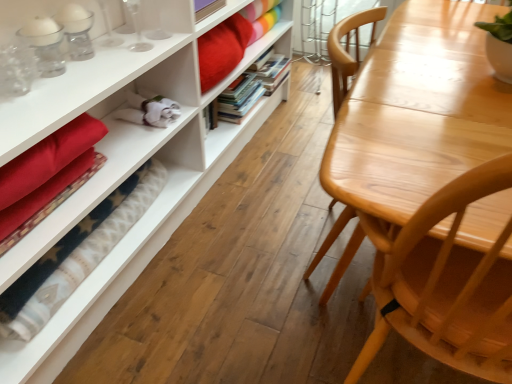
The height and width of the screenshot is (384, 512). In order to click on hardcover books at center, the 2th book viewed from the front in this screenshot , I will do `click(273, 72)`.

Measure the distance between velvet red blanket at lower left and camera.

The distance of velvet red blanket at lower left from camera is 39.24 inches.

In order to face velvet red blanket at lower left, should I rotate leftwards or rightwards?

A 19.939 degree turn to the left will do.

The height and width of the screenshot is (384, 512). I want to click on hardcover books at center, the 2th book viewed from the front, so click(x=273, y=72).

Based on the photo, is hardcover books at center, arranged as the second book when viewed from the back, oriented towards matte white bookcase at left?

No, hardcover books at center, arranged as the second book when viewed from the back, does not turn towards matte white bookcase at left.

From the image's perspective, is hardcover books at center, positioned as the first book in front-to-back order, above or below matte white bookcase at left?

Based on their image positions, hardcover books at center, positioned as the first book in front-to-back order, is located above matte white bookcase at left.

Does hardcover books at center, positioned as the first book in front-to-back order, lie behind matte white bookcase at left?

That is True.

Is matte white bookcase at left positioned with its back to hardcover books at center, arranged as the first book when viewed from the back?

matte white bookcase at left does not have its back to hardcover books at center, arranged as the first book when viewed from the back.

Who is smaller, matte white bookcase at left or hardcover books at center, the 2th book viewed from the front?

With smaller size is hardcover books at center, the 2th book viewed from the front.

Can you tell me how much matte white bookcase at left and hardcover books at center, the 2th book viewed from the front, differ in facing direction?

The angular difference between matte white bookcase at left and hardcover books at center, the 2th book viewed from the front, is 89.7 degrees.

Between matte white bookcase at left and hardcover books at center, arranged as the first book when viewed from the back, which one has less height?

With less height is matte white bookcase at left.

From a real-world perspective, which object stands above the other?

From a 3D spatial view, hardcover books at center, arranged as the first book when viewed from the back, is above.

Which of these two, velvet red blanket at lower left or hardcover books at center, the 2th book viewed from the front, is thinner?

Thinner between the two is velvet red blanket at lower left.

Does velvet red blanket at lower left have a lesser height compared to hardcover books at center, the 2th book viewed from the front?

Yes.

Is velvet red blanket at lower left in front of or behind hardcover books at center, arranged as the first book when viewed from the back, in the image?

Visually, velvet red blanket at lower left is located in front of hardcover books at center, arranged as the first book when viewed from the back.

How distant is hardcover books at center, the 2th book viewed from the front, from matte white bookcase at left?

hardcover books at center, the 2th book viewed from the front, is 33.00 inches from matte white bookcase at left.

Is hardcover books at center, the 2th book viewed from the front, with matte white bookcase at left?

There is a gap between hardcover books at center, the 2th book viewed from the front, and matte white bookcase at left.

From a real-world perspective, who is located lower, hardcover books at center, arranged as the first book when viewed from the back, or matte white bookcase at left?

matte white bookcase at left, from a real-world perspective.

Does hardcover books at center, the 2th book viewed from the front, have a larger size compared to matte white bookcase at left?

No.

In the scene shown: From the image's perspective, is light wood table at right positioned above or below velvet red blanket at lower left?

From the image's perspective, light wood table at right appears above velvet red blanket at lower left.

Based on the photo, which of these two, light wood table at right or velvet red blanket at lower left, stands taller?

Standing taller between the two is light wood table at right.

Is velvet red blanket at lower left at the back of light wood table at right?

No, light wood table at right is not facing the opposite direction of velvet red blanket at lower left.

Considering the relative sizes of light wood table at right and velvet red blanket at lower left in the image provided, is light wood table at right bigger than velvet red blanket at lower left?

Yes.

Can you confirm if hardcover books at center, arranged as the first book when viewed from the back, is positioned to the left of hardcover books at center, arranged as the second book when viewed from the back?

No, hardcover books at center, arranged as the first book when viewed from the back, is not to the left of hardcover books at center, arranged as the second book when viewed from the back.

Considering the relative sizes of hardcover books at center, arranged as the first book when viewed from the back, and hardcover books at center, positioned as the first book in front-to-back order, in the image provided, is hardcover books at center, arranged as the first book when viewed from the back, thinner than hardcover books at center, positioned as the first book in front-to-back order,?

Yes.

Is hardcover books at center, the 2th book viewed from the front, oriented towards hardcover books at center, arranged as the second book when viewed from the back?

No, hardcover books at center, the 2th book viewed from the front, does not turn towards hardcover books at center, arranged as the second book when viewed from the back.

How much distance is there between hardcover books at center, the 2th book viewed from the front, and hardcover books at center, arranged as the second book when viewed from the back?

The distance of hardcover books at center, the 2th book viewed from the front, from hardcover books at center, arranged as the second book when viewed from the back, is 7.90 inches.

Is velvet red blanket at lower left completely or partially inside matte white bookcase at left?

Actually, velvet red blanket at lower left is outside matte white bookcase at left.

Between matte white bookcase at left and velvet red blanket at lower left, which one appears on the right side from the viewer's perspective?

matte white bookcase at left is more to the right.

Is point (30, 262) more distant than point (156, 192)?

No.

Locate an element on the screen. The height and width of the screenshot is (384, 512). bookcase in front of the hardcover books at center, positioned as the first book in front-to-back order is located at coordinates (x=127, y=175).

Find the location of `book that is the 1st object to the left of the matte white bookcase at left, starting at the anchor`. book that is the 1st object to the left of the matte white bookcase at left, starting at the anchor is located at coordinates (273, 72).

Which object lies further to the anchor point velvet red blanket at lower left, matte white bookcase at left or light wood table at right?

light wood table at right is positioned further to the anchor velvet red blanket at lower left.

Which object lies further to the anchor point velvet red blanket at lower left, hardcover books at center, arranged as the second book when viewed from the back, or hardcover books at center, the 2th book viewed from the front?

The object further to velvet red blanket at lower left is hardcover books at center, the 2th book viewed from the front.

From the image, which object appears to be farther from hardcover books at center, arranged as the second book when viewed from the back, hardcover books at center, the 2th book viewed from the front, or light wood table at right?

The object further to hardcover books at center, arranged as the second book when viewed from the back, is light wood table at right.

Based on the photo, considering their positions, is hardcover books at center, arranged as the second book when viewed from the back, positioned closer to hardcover books at center, arranged as the first book when viewed from the back, than light wood table at right?

Among the two, hardcover books at center, arranged as the second book when viewed from the back, is located nearer to hardcover books at center, arranged as the first book when viewed from the back.

When comparing their distances from hardcover books at center, positioned as the first book in front-to-back order, does hardcover books at center, arranged as the first book when viewed from the back, or matte white bookcase at left seem further?

The object further to hardcover books at center, positioned as the first book in front-to-back order, is matte white bookcase at left.

Looking at the image, which one is located further to matte white bookcase at left, velvet red blanket at lower left or hardcover books at center, the 2th book viewed from the front?

hardcover books at center, the 2th book viewed from the front, is further to matte white bookcase at left.

When comparing their distances from light wood table at right, does velvet red blanket at lower left or hardcover books at center, arranged as the first book when viewed from the back, seem further?

The object further to light wood table at right is hardcover books at center, arranged as the first book when viewed from the back.

Which object lies further to the anchor point velvet red blanket at lower left, matte white bookcase at left or hardcover books at center, positioned as the first book in front-to-back order?

hardcover books at center, positioned as the first book in front-to-back order, lies further to velvet red blanket at lower left than the other object.

Find the location of a particular element. The image size is (512, 384). blanket between light wood table at right and hardcover books at center, arranged as the first book when viewed from the back, in the front-back direction is located at coordinates (x=86, y=255).

The width and height of the screenshot is (512, 384). I want to click on book located between light wood table at right and hardcover books at center, the 2th book viewed from the front, in the depth direction, so click(x=239, y=98).

Where is `blanket located between matte white bookcase at left and hardcover books at center, arranged as the second book when viewed from the back, in the depth direction`? Image resolution: width=512 pixels, height=384 pixels. blanket located between matte white bookcase at left and hardcover books at center, arranged as the second book when viewed from the back, in the depth direction is located at coordinates (86, 255).

This screenshot has width=512, height=384. I want to click on table between matte white bookcase at left and hardcover books at center, the 2th book viewed from the front, in the front-back direction, so click(414, 114).